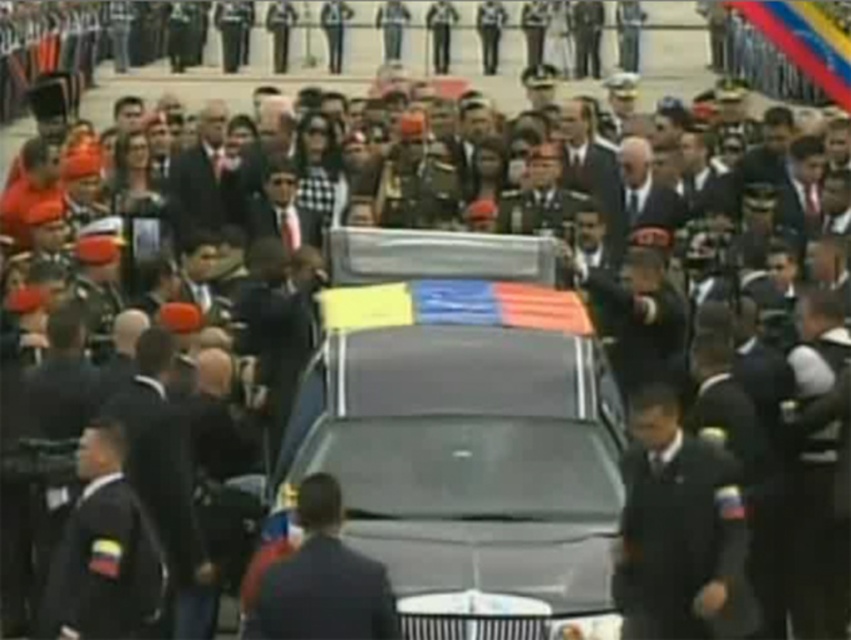
Can you confirm if metallic gray car at center is shorter than black uniform at center?

Indeed, metallic gray car at center has a lesser height compared to black uniform at center.

Find the location of a particular element. metallic gray car at center is located at coordinates (461, 419).

Where is `metallic gray car at center`? metallic gray car at center is located at coordinates (461, 419).

Does metallic gray car at center have a smaller size compared to dark blue uniform at center?

Indeed, metallic gray car at center has a smaller size compared to dark blue uniform at center.

Is the position of metallic gray car at center less distant than that of dark blue uniform at center?

No, it is not.

Is point (360, 468) closer to viewer compared to point (700, 529)?

No, (360, 468) is further to viewer.

Image resolution: width=851 pixels, height=640 pixels. I want to click on metallic gray car at center, so click(461, 419).

Is point (96, 445) farther from viewer compared to point (176, 625)?

No, (96, 445) is in front of (176, 625).

Who is positioned more to the left, black uniform at left or black uniform at center?

From the viewer's perspective, black uniform at left appears more on the left side.

Between point (86, 490) and point (163, 422), which one is positioned in front?

Point (86, 490)

Locate an element on the screen. black uniform at left is located at coordinates (104, 550).